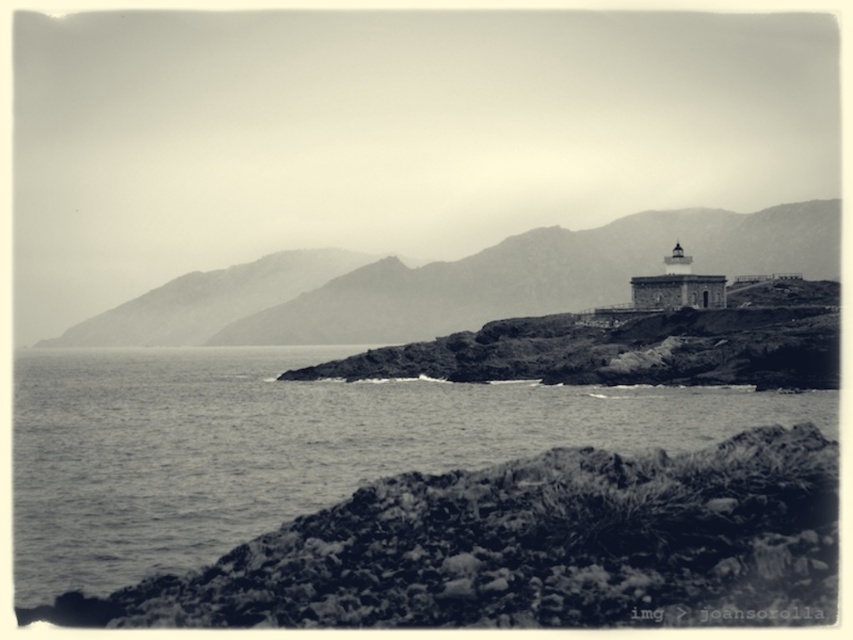
Question: Among these points, which one is farthest from the camera?

Choices:
 (A) (566, 269)
 (B) (161, 352)

Answer: (B)

Question: Does smooth water at lower left have a smaller size compared to rugged stone mountain at center?

Choices:
 (A) yes
 (B) no

Answer: (A)

Question: Which point is closer to the camera taking this photo?

Choices:
 (A) (491, 288)
 (B) (218, 448)

Answer: (B)

Question: Which object is closer to the camera taking this photo?

Choices:
 (A) rugged stone mountain at center
 (B) smooth water at lower left

Answer: (B)

Question: Is smooth water at lower left below rugged stone mountain at center?

Choices:
 (A) no
 (B) yes

Answer: (B)

Question: Does smooth water at lower left come in front of rugged stone mountain at center?

Choices:
 (A) no
 (B) yes

Answer: (B)